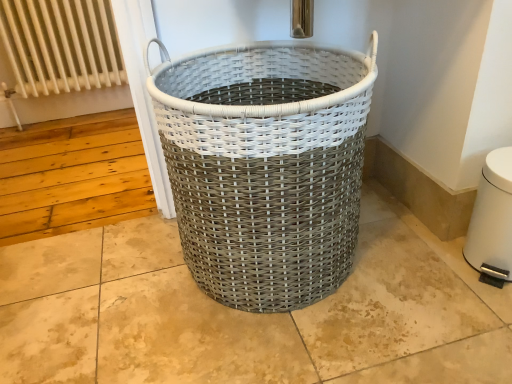
The image size is (512, 384). What are the coordinates of `vacant space in front of white woven basket at center` in the screenshot? It's located at point(301,351).